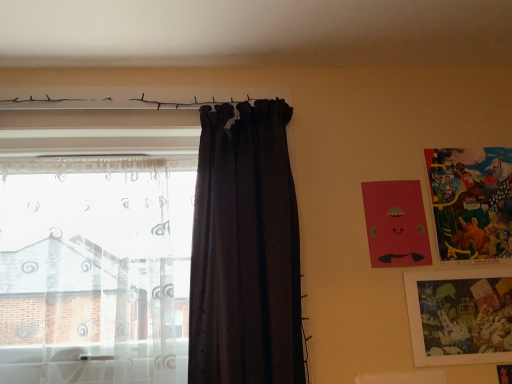
Question: Are matte red picture frame at upper right, positioned as the second picture frame in top-to-bottom order, and transparent sheer curtain at left, the 1th curtain from the left, located far from each other?

Choices:
 (A) yes
 (B) no

Answer: (B)

Question: Does matte red picture frame at upper right, marked as the second picture frame in a bottom-to-top arrangement, come behind transparent sheer curtain at left, the 2th curtain when ordered from right to left?

Choices:
 (A) yes
 (B) no

Answer: (A)

Question: From a real-world perspective, is matte red picture frame at upper right, positioned as the second picture frame in top-to-bottom order, located beneath transparent sheer curtain at left, the 1th curtain from the left?

Choices:
 (A) no
 (B) yes

Answer: (A)

Question: Considering the relative sizes of matte red picture frame at upper right, positioned as the second picture frame in top-to-bottom order, and transparent sheer curtain at left, the 2th curtain when ordered from right to left, in the image provided, is matte red picture frame at upper right, positioned as the second picture frame in top-to-bottom order, wider than transparent sheer curtain at left, the 2th curtain when ordered from right to left,?

Choices:
 (A) no
 (B) yes

Answer: (A)

Question: Considering the relative sizes of matte red picture frame at upper right, positioned as the second picture frame in top-to-bottom order, and transparent sheer curtain at left, the 2th curtain when ordered from right to left, in the image provided, is matte red picture frame at upper right, positioned as the second picture frame in top-to-bottom order, bigger than transparent sheer curtain at left, the 2th curtain when ordered from right to left,?

Choices:
 (A) no
 (B) yes

Answer: (A)

Question: Is matte red picture frame at upper right, positioned as the second picture frame in top-to-bottom order, inside the boundaries of multicolored paper picture frame at upper right, acting as the first picture frame starting from the top, or outside?

Choices:
 (A) inside
 (B) outside

Answer: (B)

Question: Is matte red picture frame at upper right, marked as the second picture frame in a bottom-to-top arrangement, wider or thinner than multicolored paper picture frame at upper right, acting as the first picture frame starting from the top?

Choices:
 (A) wide
 (B) thin

Answer: (B)

Question: In the image, is matte red picture frame at upper right, marked as the second picture frame in a bottom-to-top arrangement, on the left side or the right side of multicolored paper picture frame at upper right, acting as the first picture frame starting from the top?

Choices:
 (A) left
 (B) right

Answer: (A)

Question: Is matte red picture frame at upper right, marked as the second picture frame in a bottom-to-top arrangement, taller or shorter than multicolored paper picture frame at upper right, acting as the third picture frame starting from the bottom?

Choices:
 (A) tall
 (B) short

Answer: (B)

Question: Based on their positions, is multicolored paper picture frame at upper right, acting as the third picture frame starting from the bottom, located to the left or right of transparent sheer curtain at left, the 1th curtain from the left?

Choices:
 (A) left
 (B) right

Answer: (B)

Question: From the image's perspective, is multicolored paper picture frame at upper right, acting as the first picture frame starting from the top, above or below transparent sheer curtain at left, the 1th curtain from the left?

Choices:
 (A) above
 (B) below

Answer: (A)

Question: In terms of size, does multicolored paper picture frame at upper right, acting as the third picture frame starting from the bottom, appear bigger or smaller than transparent sheer curtain at left, the 1th curtain from the left?

Choices:
 (A) big
 (B) small

Answer: (B)

Question: From a real-world perspective, relative to transparent sheer curtain at left, the 2th curtain when ordered from right to left, is multicolored paper picture frame at upper right, acting as the third picture frame starting from the bottom, vertically above or below?

Choices:
 (A) below
 (B) above

Answer: (B)

Question: Is point (271, 269) positioned closer to the camera than point (465, 306)?

Choices:
 (A) farther
 (B) closer

Answer: (B)

Question: From a real-world perspective, is dark matte fabric curtain at center, the first curtain when ordered from right to left, above or below matte plastic picture frame at lower right, which ranks as the 3th picture frame in top-to-bottom order?

Choices:
 (A) above
 (B) below

Answer: (A)